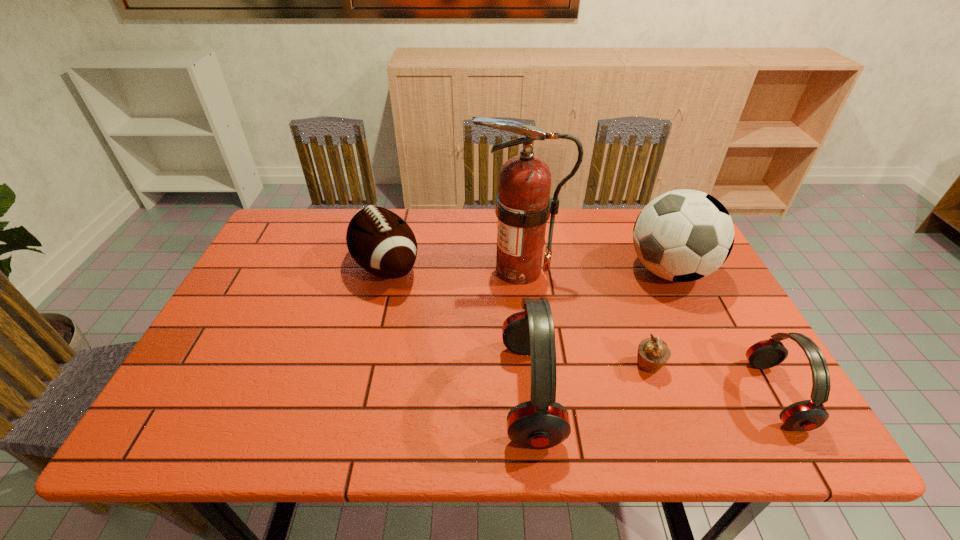
At what (x,y) coordinates should I click in order to perform the action: click on free space located 0.190m on the ear cups of the right earphone. Please return your answer as a coordinate pair (x, y). This screenshot has height=540, width=960. Looking at the image, I should click on (669, 395).

Identify the location of vacant space located 0.050m on the ear cups of the right earphone. The width and height of the screenshot is (960, 540). (734, 395).

Find the location of a particular element. blank space located 0.390m on the main logo of the soccer ball is located at coordinates (490, 271).

Locate an element on the screen. Image resolution: width=960 pixels, height=540 pixels. vacant area situated on the main logo of the soccer ball is located at coordinates (514, 271).

In order to click on vacant space located on the main logo of the soccer ball in this screenshot , I will do `click(580, 271)`.

Identify the location of vacant area located at the nozzle of the fire extinguisher. The width and height of the screenshot is (960, 540). (429, 269).

Where is `free space located at the nozzle of the fire extinguisher`? This screenshot has height=540, width=960. free space located at the nozzle of the fire extinguisher is located at coordinates (394, 269).

You are a GUI agent. You are given a task and a screenshot of the screen. Output one action in this format:
    pyautogui.click(x=<x>, y=<y>)
    Task: Click on the free location located 0.200m at the nozzle of the fire extinguisher
    The width and height of the screenshot is (960, 540).
    Given the screenshot: What is the action you would take?
    tap(404, 269)

What are the coordinates of `free space located on the right of the leftmost object` in the screenshot? It's located at (497, 267).

At what (x,y) coordinates should I click in order to perform the action: click on free location located 0.110m on the left of the shortest object. Please return your answer as a coordinate pair (x, y). This screenshot has height=540, width=960. Looking at the image, I should click on (586, 366).